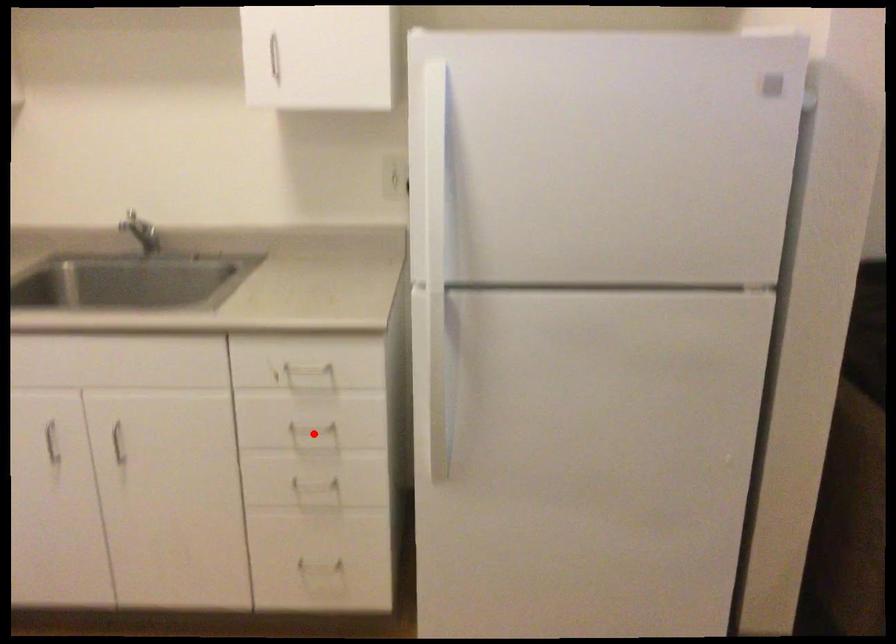
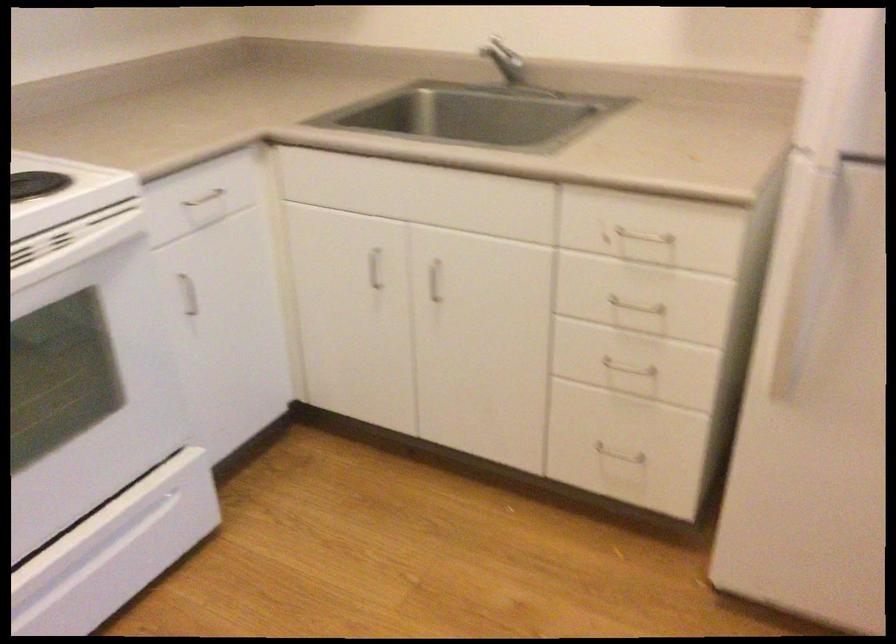
Question: I am providing you with two images of the same scene from different viewpoints. Image1 has a red point marked. In image2, the corresponding 3D location appears at what relative position? Reply with the corresponding letter.

Choices:
 (A) Closer
 (B) Farther

Answer: (A)